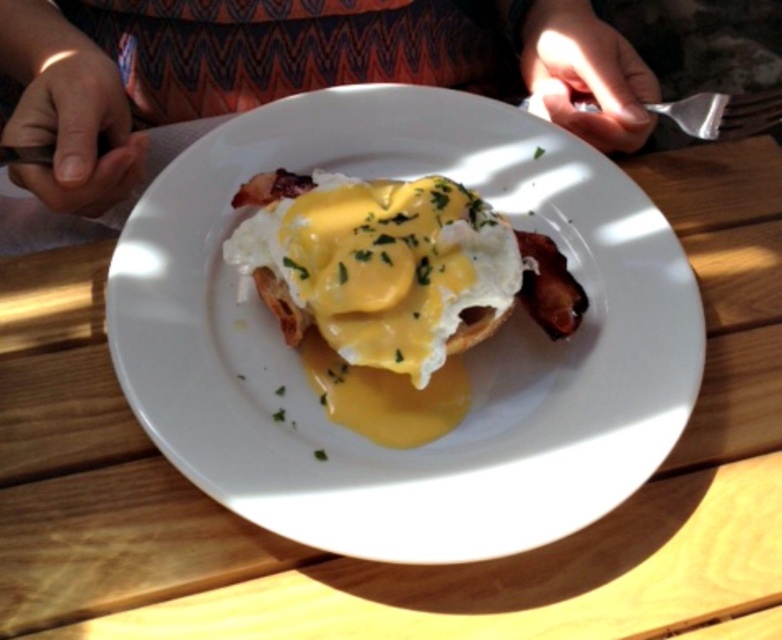
Question: Which object appears closest to the camera in this image?

Choices:
 (A) silver metallic fork at upper right
 (B) metallic silver fork at upper right
 (C) white glossy plate at center

Answer: (C)

Question: Which point is closer to the camera?

Choices:
 (A) patterned fabric shirt at center
 (B) metallic silver fork at upper right
 (C) white creamy egg at center
 (D) white glossy plate at center

Answer: (D)

Question: Is white glossy plate at center bigger than metallic silver fork at upper right?

Choices:
 (A) yes
 (B) no

Answer: (B)

Question: Which is farther from the white creamy egg at center?

Choices:
 (A) silver metallic fork at upper right
 (B) patterned fabric shirt at center
 (C) metallic silver fork at upper right

Answer: (C)

Question: Is patterned fabric shirt at center wider than silver metallic fork at upper right?

Choices:
 (A) no
 (B) yes

Answer: (A)

Question: Is patterned fabric shirt at center wider than metallic silver fork at upper right?

Choices:
 (A) no
 (B) yes

Answer: (A)